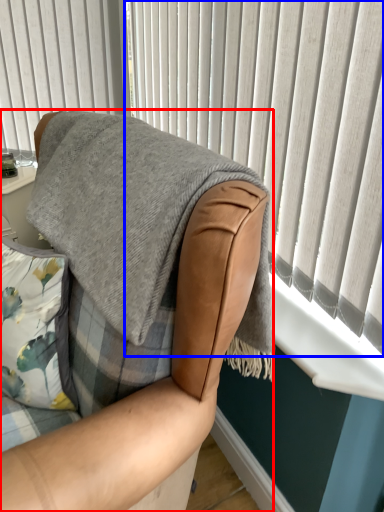
Question: Among these objects, which one is nearest to the camera, chair (highlighted by a red box) or curtain (highlighted by a blue box)?

Choices:
 (A) chair
 (B) curtain

Answer: (A)